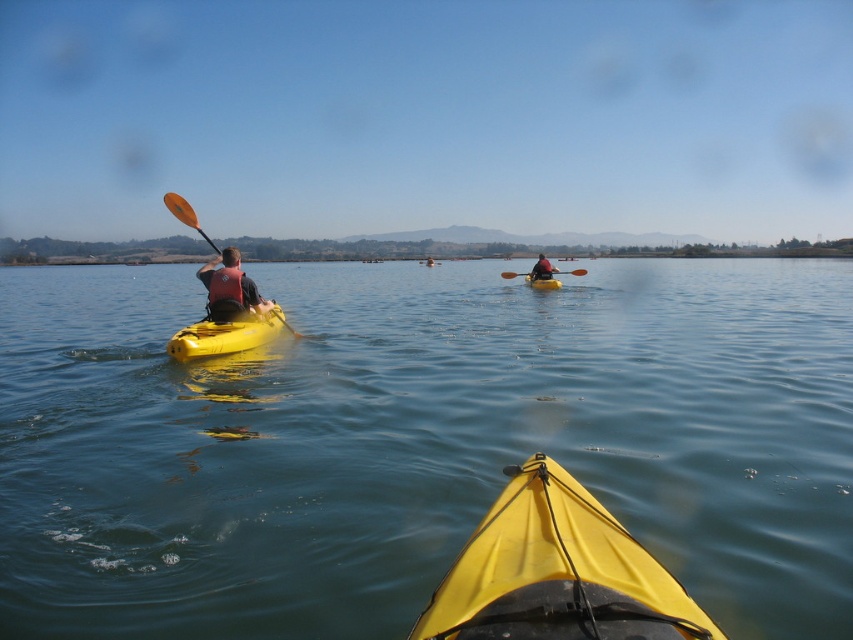
You are in a kayak and want to know which kayak is closer to you. You see the yellow matte kayak at lower center and the matte yellow kayak at left. Based on their height in the image, which one is closer?

The yellow matte kayak at lower center is not as tall as the matte yellow kayak at left, so the yellow matte kayak at lower center is closer to you because objects closer appear larger in height.

You are in a kayak and see the clear blue water at center and the orange paddle at center. Which object is below the other?

The clear blue water at center is positioned under orange paddle at center, so the clear blue water at center is below the orange paddle at center.

You are in a yellow kayak and want to paddle to the other kayak. The distance between the yellow matte kayak at lower center and the matte yellow kayak at left is 7.62 meters. Can you safely reach them if your maximum paddling distance is 8 meters?

The yellow matte kayak at lower center and the matte yellow kayak at left are 7.62 meters apart. Since your maximum paddling distance is 8 meters, you can safely reach them as the distance is within your capability.